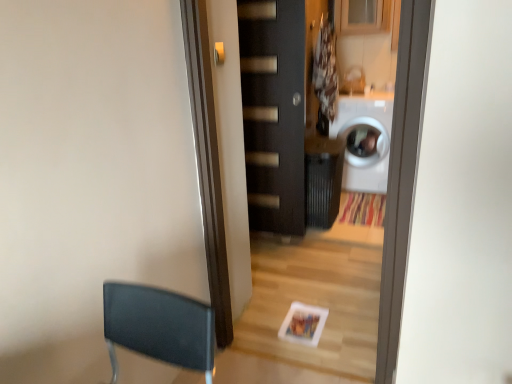
Question: Is white glossy washing machine at right looking in the opposite direction of satin silver door handle at upper center?

Choices:
 (A) yes
 (B) no

Answer: (B)

Question: Can you confirm if white glossy washing machine at right is taller than satin silver door handle at upper center?

Choices:
 (A) yes
 (B) no

Answer: (A)

Question: From a real-world perspective, is white glossy washing machine at right positioned under satin silver door handle at upper center based on gravity?

Choices:
 (A) yes
 (B) no

Answer: (A)

Question: Considering the relative sizes of white glossy washing machine at right and satin silver door handle at upper center in the image provided, is white glossy washing machine at right smaller than satin silver door handle at upper center?

Choices:
 (A) yes
 (B) no

Answer: (B)

Question: From the image's perspective, is white glossy washing machine at right below satin silver door handle at upper center?

Choices:
 (A) no
 (B) yes

Answer: (B)

Question: From their relative heights in the image, would you say white glossy washing machine at right is taller or shorter than satin silver door handle at upper center?

Choices:
 (A) tall
 (B) short

Answer: (A)

Question: From a real-world perspective, is white glossy washing machine at right positioned above or below satin silver door handle at upper center?

Choices:
 (A) below
 (B) above

Answer: (A)

Question: Considering the positions of point (367, 130) and point (214, 49), is point (367, 130) closer or farther from the camera than point (214, 49)?

Choices:
 (A) closer
 (B) farther

Answer: (B)

Question: Looking at the image, does white glossy washing machine at right seem bigger or smaller compared to satin silver door handle at upper center?

Choices:
 (A) small
 (B) big

Answer: (B)

Question: Visually, is white glossy washing machine at right positioned to the left or to the right of matte black door at center?

Choices:
 (A) right
 (B) left

Answer: (A)

Question: Looking at the image, does white glossy washing machine at right seem bigger or smaller compared to matte black door at center?

Choices:
 (A) small
 (B) big

Answer: (B)

Question: Is white glossy washing machine at right inside or outside of matte black door at center?

Choices:
 (A) inside
 (B) outside

Answer: (B)

Question: In terms of height, does white glossy washing machine at right look taller or shorter compared to matte black door at center?

Choices:
 (A) short
 (B) tall

Answer: (A)

Question: Is satin silver door handle at upper center spatially inside matte black door at center, or outside of it?

Choices:
 (A) inside
 (B) outside

Answer: (B)

Question: From a real-world perspective, is satin silver door handle at upper center above or below matte black door at center?

Choices:
 (A) below
 (B) above

Answer: (B)